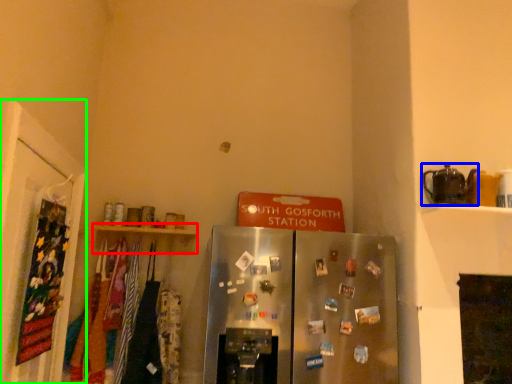
Question: Which object is the farthest from shelf (highlighted by a red box)? Choose among these: appliance (highlighted by a blue box) or door (highlighted by a green box).

Choices:
 (A) appliance
 (B) door

Answer: (A)